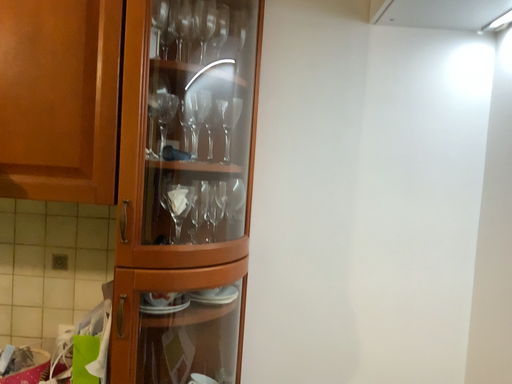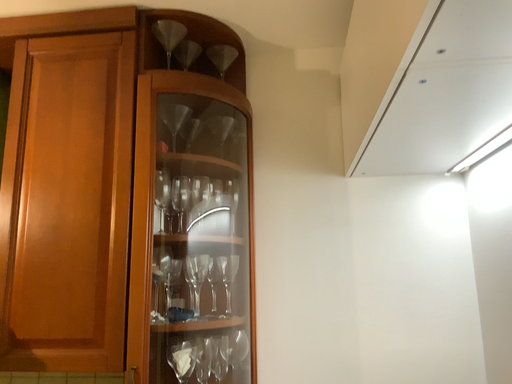
Question: Which way did the camera rotate in the video?

Choices:
 (A) rotated downward
 (B) rotated upward

Answer: (B)